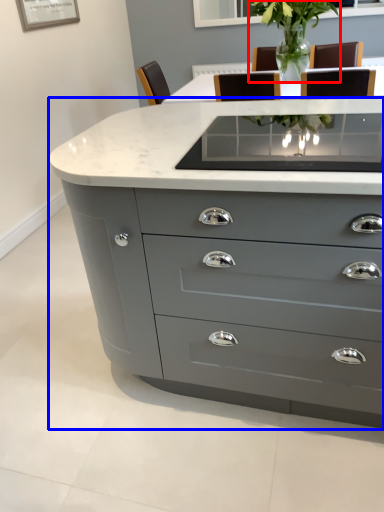
Question: Which object is further to the camera taking this photo, plant (highlighted by a red box) or chest of drawers (highlighted by a blue box)?

Choices:
 (A) plant
 (B) chest of drawers

Answer: (A)